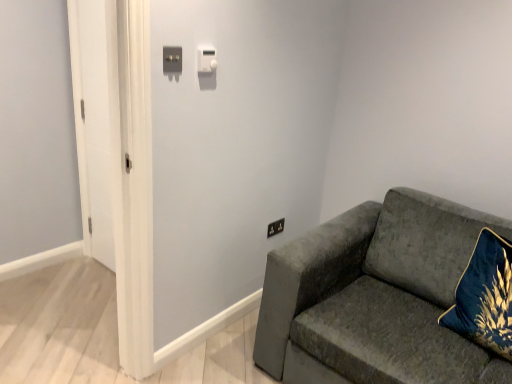
In order to click on free space to the left of white glossy door at left in this screenshot , I will do `click(70, 269)`.